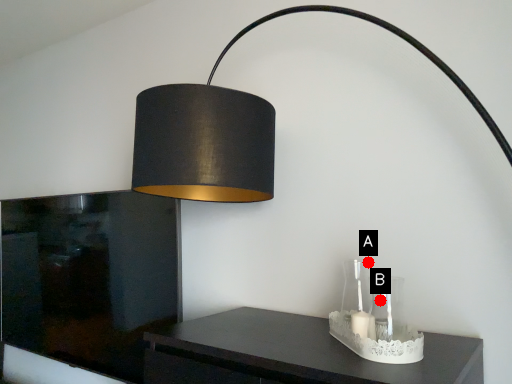
Question: Two points are circled on the image, labeled by A and B beside each circle. Which point appears closest to the camera in this image?

Choices:
 (A) A is closer
 (B) B is closer

Answer: (B)